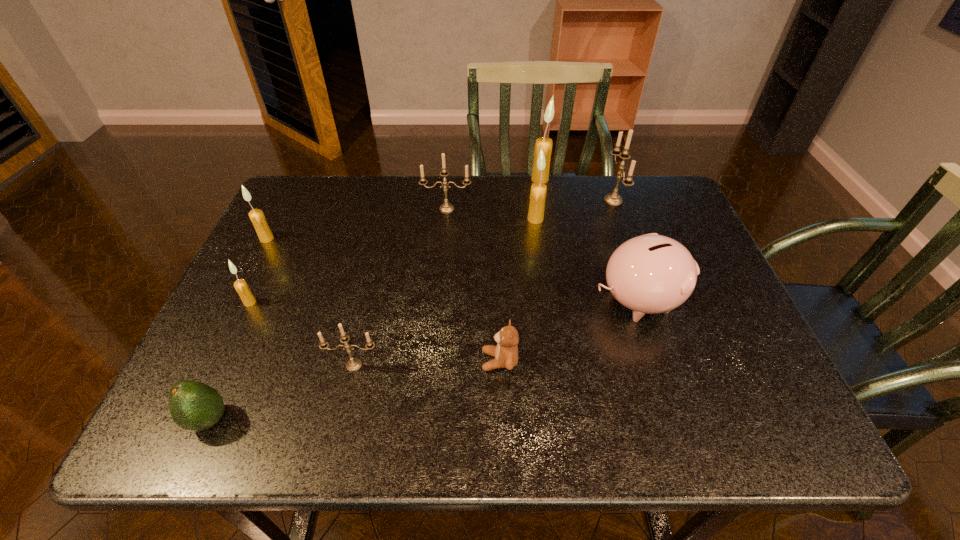
Locate an element on the screen. Image resolution: width=960 pixels, height=540 pixels. the tallest candle is located at coordinates (546, 143).

This screenshot has width=960, height=540. What are the coordinates of `the tallest object` in the screenshot? It's located at (546, 143).

Find the location of a particular element. This screenshot has width=960, height=540. the biggest metallic candle is located at coordinates (614, 198).

You are a GUI agent. You are given a task and a screenshot of the screen. Output one action in this format:
    pyautogui.click(x=<x>, y=<y>)
    Task: Click on the rightmost candle
    Image resolution: width=960 pixels, height=540 pixels.
    Given the screenshot: What is the action you would take?
    pyautogui.click(x=614, y=198)

You are a GUI agent. You are given a task and a screenshot of the screen. Output one action in this format:
    pyautogui.click(x=<x>, y=<y>)
    Task: Click on the second biggest cream candle
    This screenshot has height=540, width=960.
    Given the screenshot: What is the action you would take?
    pyautogui.click(x=538, y=190)

Locate an element on the screen. This screenshot has height=540, width=960. the third biggest cream candle is located at coordinates (257, 217).

Where is `the fifth farthest object`? This screenshot has height=540, width=960. the fifth farthest object is located at coordinates (257, 217).

Identify the location of the second smallest metallic candle. The image size is (960, 540). (446, 207).

You are a GUI agent. You are given a task and a screenshot of the screen. Output one action in this format:
    pyautogui.click(x=<x>, y=<y>)
    Task: Click on the second metallic candle from right to left
    This screenshot has height=540, width=960.
    Given the screenshot: What is the action you would take?
    pyautogui.click(x=446, y=207)

Locate an element on the screen. Image resolution: width=960 pixels, height=540 pixels. piggy bank is located at coordinates (649, 274).